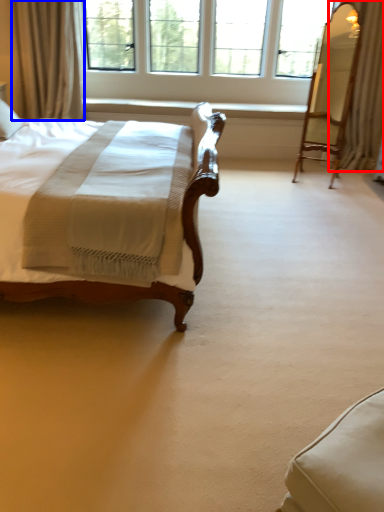
Question: Which point is further to the camera, curtain (highlighted by a red box) or curtain (highlighted by a blue box)?

Choices:
 (A) curtain
 (B) curtain

Answer: (B)